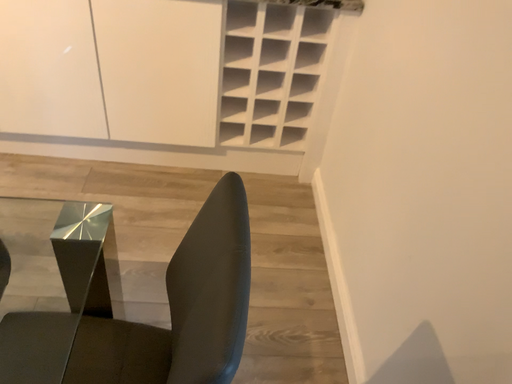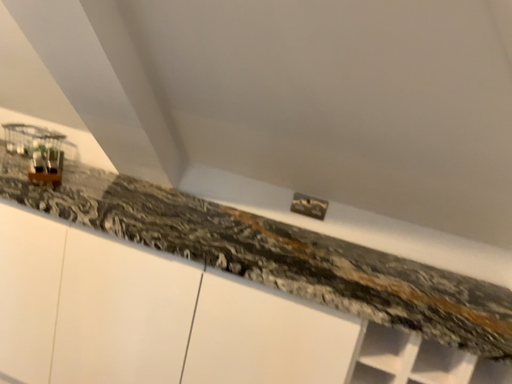
Question: How did the camera likely rotate when shooting the video?

Choices:
 (A) rotated left
 (B) rotated right

Answer: (A)